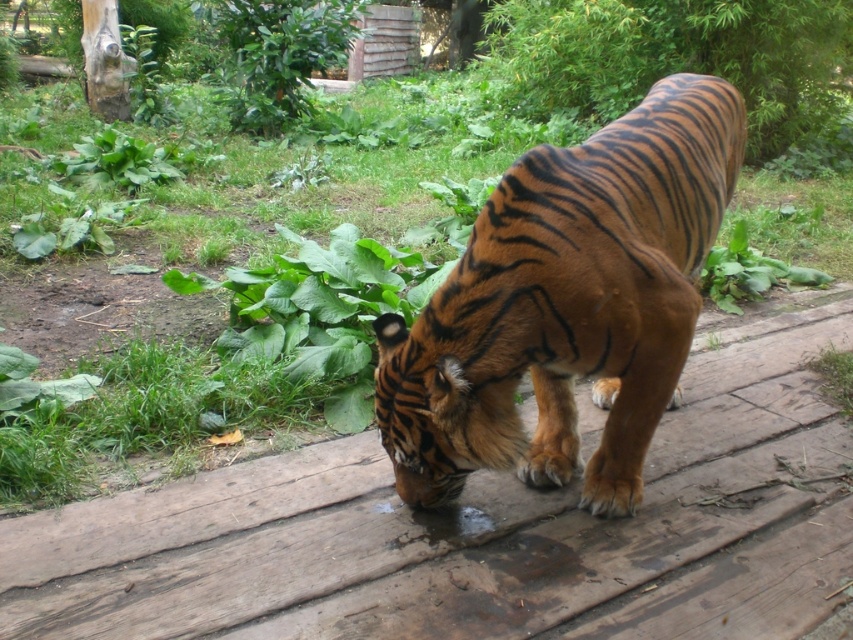
Question: Among these objects, which one is farthest from the camera?

Choices:
 (A) green leafy grass at center
 (B) orange-brown fur tiger at center

Answer: (A)

Question: Is wooden plank at center to the left of green leafy grass at center from the viewer's perspective?

Choices:
 (A) yes
 (B) no

Answer: (B)

Question: Which object is the closest to the orange-brown fur tiger at center?

Choices:
 (A) wooden plank at center
 (B) green leafy grass at center

Answer: (A)

Question: Does orange-brown fur tiger at center appear over green leafy grass at center?

Choices:
 (A) yes
 (B) no

Answer: (A)

Question: Which object is the farthest from the green leafy grass at center?

Choices:
 (A) wooden plank at center
 (B) orange-brown fur tiger at center

Answer: (B)

Question: Can you confirm if orange-brown fur tiger at center is smaller than green leafy grass at center?

Choices:
 (A) no
 (B) yes

Answer: (B)